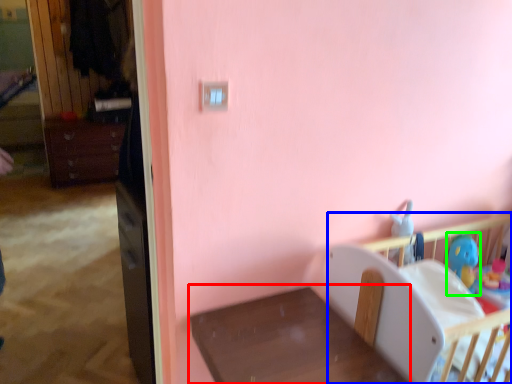
Question: Based on their relative distances, which object is nearer to furniture (highlighted by a red box)? Choose from infant bed (highlighted by a blue box) and toy (highlighted by a green box).

Choices:
 (A) infant bed
 (B) toy

Answer: (A)